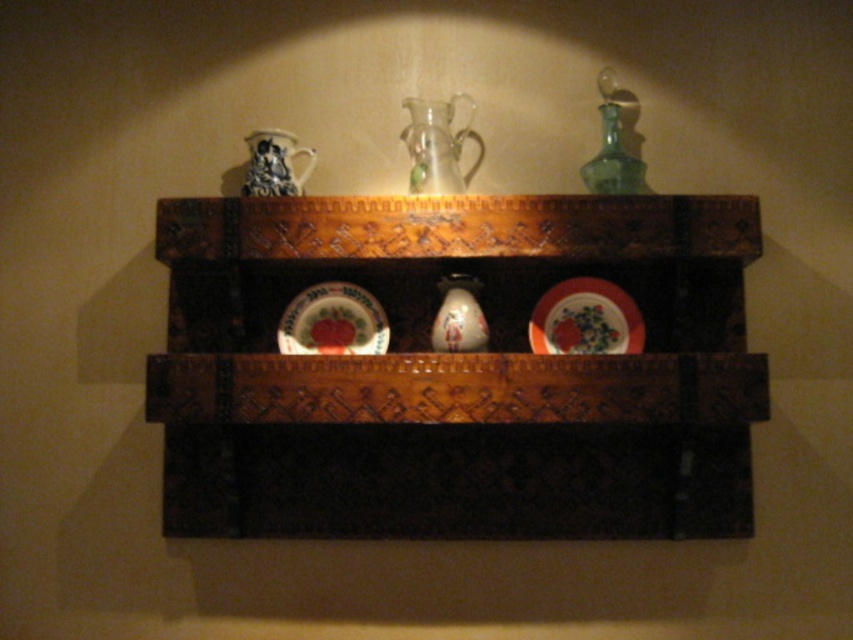
You are standing in front of the wooden shelf and want to reach a specific point on the shelf. The point is located at coordinates point [554,294]. Given that your arm can extend 1.5 meters, can you comfortably reach that point?

The distance of point [554,294] from viewer is 1.59 meters. Since your arm can only extend 1.5 meters, you cannot comfortably reach the point as it is slightly farther than your arm length.

You are standing in front of the wooden shelf and want to place a new item on the shelf. The shelf has a coordinate system where the center is at point (456,372). If you want to place the item exactly at the center of the shelf, where should you place it?

You should place the item at point (456,372), which is the center of the wooden carved shelf at center.

You are arranging flowers in the porcelain vase at center and need to place it on the shelf. If the porcelain plate at center is to the right of the vase, where should you move the vase to ensure it is directly in front of the plate?

You should move the porcelain vase at center to the left so that it is directly in front of the porcelain plate at center, which is to the right of it.